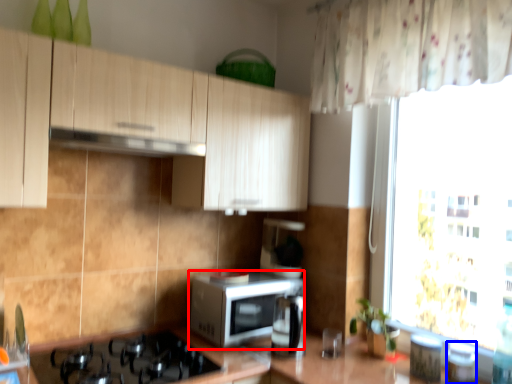
Question: Which of the following is the farthest to the observer, microwave oven (highlighted by a red box) or appliance (highlighted by a blue box)?

Choices:
 (A) microwave oven
 (B) appliance

Answer: (A)